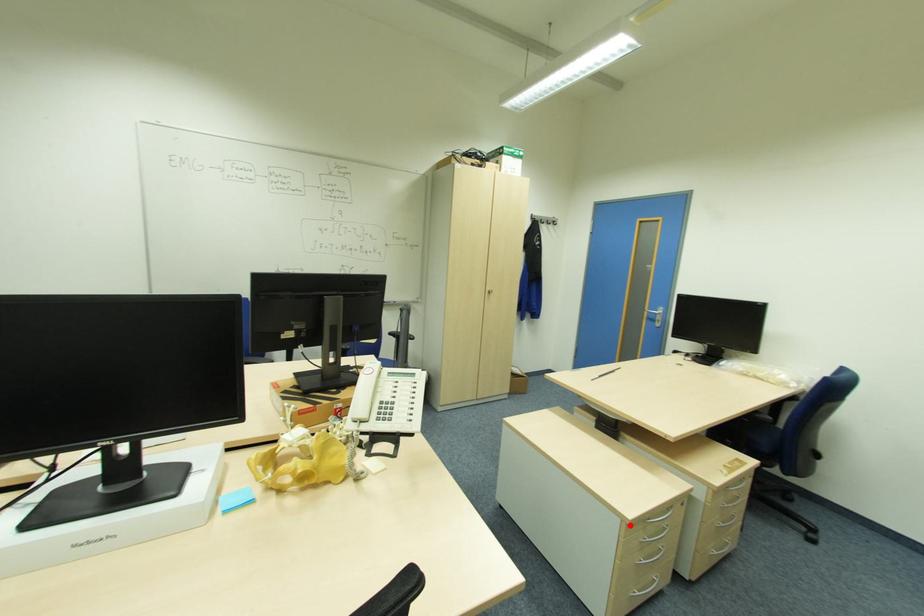
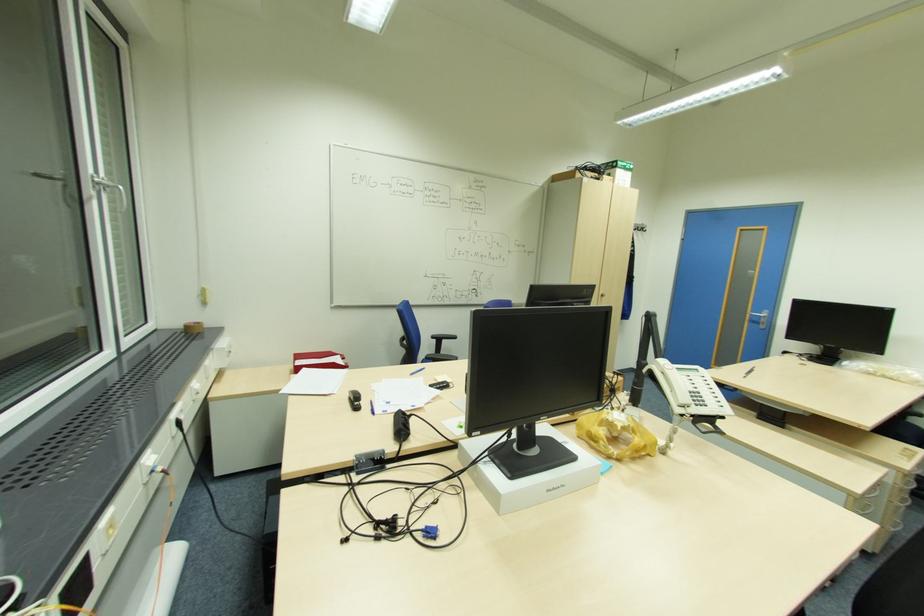
Question: I am providing you with two images of the same scene from different viewpoints. A red point is shown in image1. For the corresponding object point in image2, is it positioned nearer or farther from the camera?

Choices:
 (A) Nearer
 (B) Farther

Answer: (B)